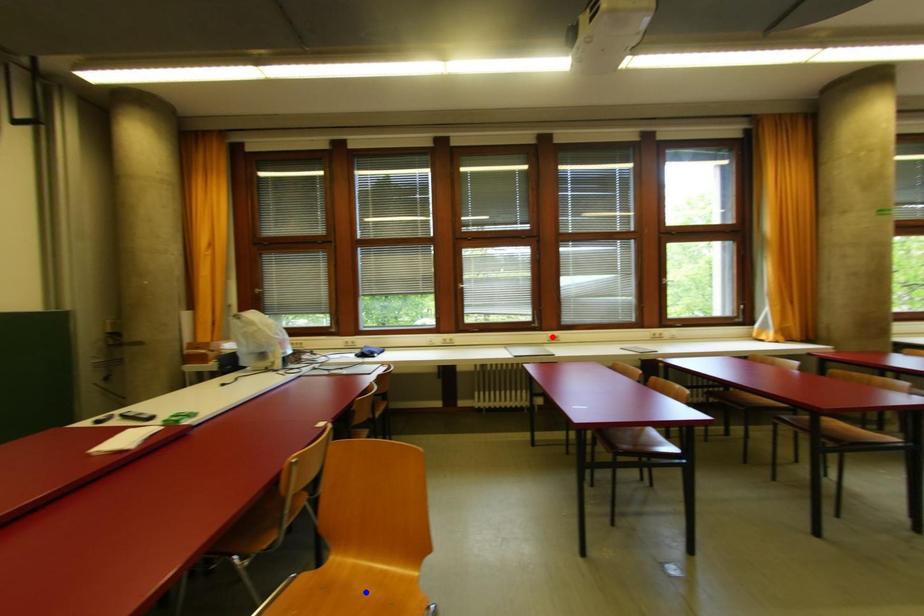
Question: Two points are marked on the image. Which point is closer to the camera?

Choices:
 (A) Blue point is closer.
 (B) Red point is closer.

Answer: (A)